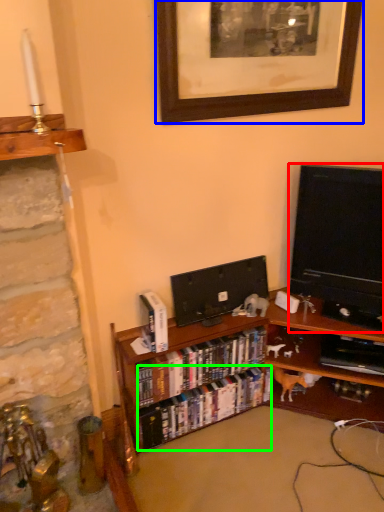
Question: Which object is the closest to the television (highlighted by a red box)? Choose among these: picture frame (highlighted by a blue box) or book (highlighted by a green box).

Choices:
 (A) picture frame
 (B) book

Answer: (A)